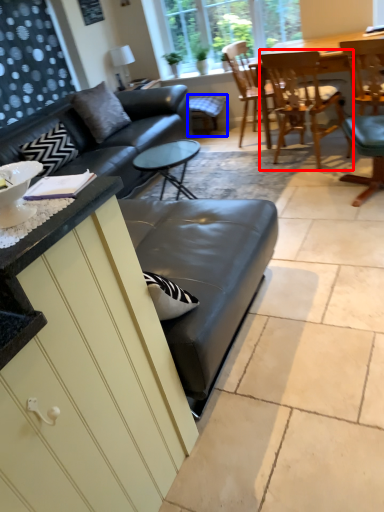
Question: Among these objects, which one is farthest to the camera, chair (highlighted by a red box) or bar stool (highlighted by a blue box)?

Choices:
 (A) chair
 (B) bar stool

Answer: (B)